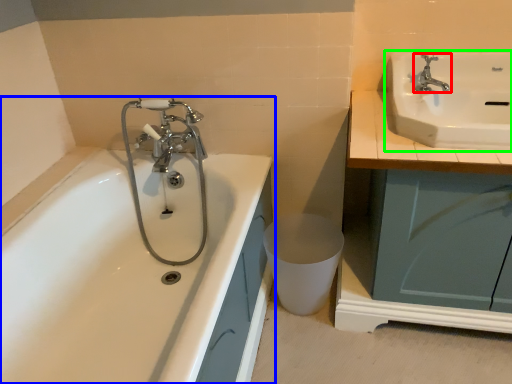
Question: Which is farther away from tap (highlighted by a red box)? bathtub (highlighted by a blue box) or sink (highlighted by a green box)?

Choices:
 (A) bathtub
 (B) sink

Answer: (A)